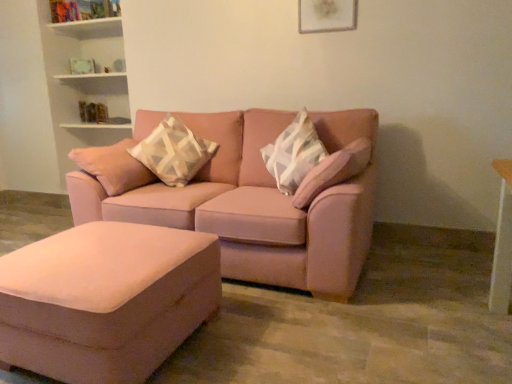
Question: Is geometric-patterned fabric pillow at center aimed at matte white picture frame at upper center?

Choices:
 (A) yes
 (B) no

Answer: (B)

Question: Is matte white picture frame at upper center completely or partially inside geometric-patterned fabric pillow at center?

Choices:
 (A) yes
 (B) no

Answer: (B)

Question: Is geometric-patterned fabric pillow at center taller than matte white picture frame at upper center?

Choices:
 (A) no
 (B) yes

Answer: (B)

Question: Is geometric-patterned fabric pillow at center next to matte white picture frame at upper center and touching it?

Choices:
 (A) yes
 (B) no

Answer: (B)

Question: From a real-world perspective, is geometric-patterned fabric pillow at center positioned under matte white picture frame at upper center based on gravity?

Choices:
 (A) no
 (B) yes

Answer: (B)

Question: From the image's perspective, is suede ottoman at lower left located above or below matte pink couch at center?

Choices:
 (A) below
 (B) above

Answer: (A)

Question: Would you say suede ottoman at lower left is to the left or to the right of matte pink couch at center in the picture?

Choices:
 (A) right
 (B) left

Answer: (B)

Question: Based on their sizes in the image, would you say suede ottoman at lower left is bigger or smaller than matte pink couch at center?

Choices:
 (A) small
 (B) big

Answer: (A)

Question: Is suede ottoman at lower left situated inside matte pink couch at center or outside?

Choices:
 (A) inside
 (B) outside

Answer: (B)

Question: Do you think matte white picture frame at upper center is within geometric-patterned fabric pillow at center, or outside of it?

Choices:
 (A) outside
 (B) inside

Answer: (A)

Question: From the image's perspective, is matte white picture frame at upper center located above or below geometric-patterned fabric pillow at center?

Choices:
 (A) below
 (B) above

Answer: (B)

Question: Considering the positions of matte white picture frame at upper center and geometric-patterned fabric pillow at center in the image, is matte white picture frame at upper center bigger or smaller than geometric-patterned fabric pillow at center?

Choices:
 (A) small
 (B) big

Answer: (A)

Question: From their relative heights in the image, would you say matte white picture frame at upper center is taller or shorter than geometric-patterned fabric pillow at center?

Choices:
 (A) short
 (B) tall

Answer: (A)

Question: Is geometric-patterned fabric pillow at center taller or shorter than matte white picture frame at upper center?

Choices:
 (A) short
 (B) tall

Answer: (B)

Question: From the image's perspective, relative to matte white picture frame at upper center, is geometric-patterned fabric pillow at center above or below?

Choices:
 (A) above
 (B) below

Answer: (B)